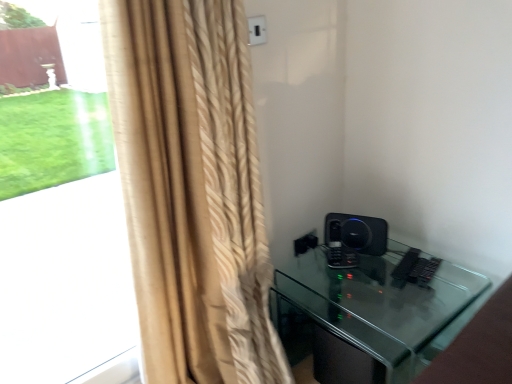
Question: Considering the relative sizes of beige textured curtain at left and black glass table at lower right in the image provided, is beige textured curtain at left taller than black glass table at lower right?

Choices:
 (A) no
 (B) yes

Answer: (B)

Question: From a real-world perspective, is beige textured curtain at left beneath black glass table at lower right?

Choices:
 (A) yes
 (B) no

Answer: (B)

Question: Would you say beige textured curtain at left contains black glass table at lower right?

Choices:
 (A) no
 (B) yes

Answer: (A)

Question: Could you tell me if beige textured curtain at left is facing black glass table at lower right?

Choices:
 (A) yes
 (B) no

Answer: (B)

Question: From the image's perspective, is beige textured curtain at left located above black glass table at lower right?

Choices:
 (A) yes
 (B) no

Answer: (A)

Question: From a real-world perspective, is beige textured curtain at left positioned above or below beige textured curtain at left?

Choices:
 (A) below
 (B) above

Answer: (A)

Question: Is point (123, 3) closer or farther from the camera than point (84, 213)?

Choices:
 (A) farther
 (B) closer

Answer: (B)

Question: Considering their positions, is beige textured curtain at left located in front of or behind beige textured curtain at left?

Choices:
 (A) behind
 (B) front

Answer: (B)

Question: From the image's perspective, is beige textured curtain at left above or below beige textured curtain at left?

Choices:
 (A) above
 (B) below

Answer: (B)

Question: From a real-world perspective, is black glass table at lower right positioned above or below beige textured curtain at left?

Choices:
 (A) below
 (B) above

Answer: (A)

Question: In the image, is black glass table at lower right positioned in front of or behind beige textured curtain at left?

Choices:
 (A) front
 (B) behind

Answer: (B)

Question: Do you think black glass table at lower right is within beige textured curtain at left, or outside of it?

Choices:
 (A) inside
 (B) outside

Answer: (B)

Question: Based on their sizes in the image, would you say black glass table at lower right is bigger or smaller than beige textured curtain at left?

Choices:
 (A) big
 (B) small

Answer: (A)

Question: Based on their positions, is beige textured curtain at left located to the left or right of black matte speaker at right?

Choices:
 (A) right
 (B) left

Answer: (B)

Question: Is beige textured curtain at left in front of or behind black matte speaker at right in the image?

Choices:
 (A) behind
 (B) front

Answer: (B)